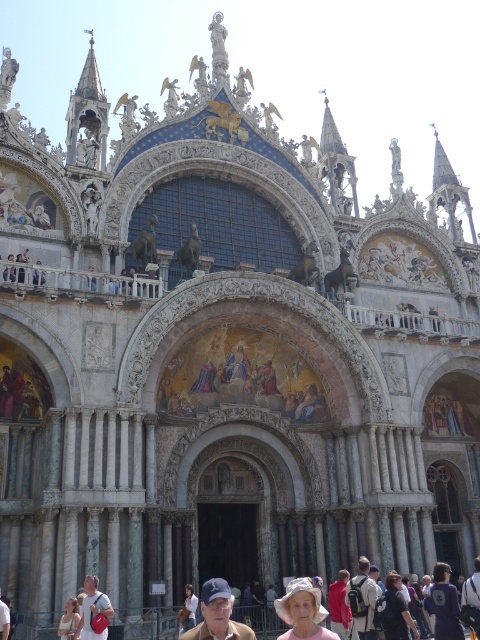
You are standing at the entrance of St. Mark Basilica and see a matte pink backpack at lower left. The basilica is 42 meters long. Can you fit the backpack inside the basilica if you walk straight ahead?

The distance between you and the matte pink backpack at lower left is 41.74 meters, which is slightly less than the basilica length of 42 meters. Therefore, the backpack can fit inside the basilica if you walk straight ahead.

You are a tourist visiting St. Mark s Basilica and you have a matte pink backpack at lower left and a red cotton shirt at center. You want to take a photo of the basilica s facade without any obstruction. Which item should you move to ensure a clear view?

The matte pink backpack at lower left is positioned on the left side of red cotton shirt at center. To ensure a clear view of the basilica s facade, you should move the matte pink backpack at lower left out of the frame since it is blocking the left side of the photo.

You are standing in front of St. Mark Basilica and want to take a photo of the main entrance. There is a point at coordinates point (94, 611) that you need to avoid blocking. Which object should you make sure not to have in front of this point?

The point (94, 611) is on the matte pink backpack at lower left. To avoid blocking this point, ensure that the matte pink backpack at lower left is not in front of it.